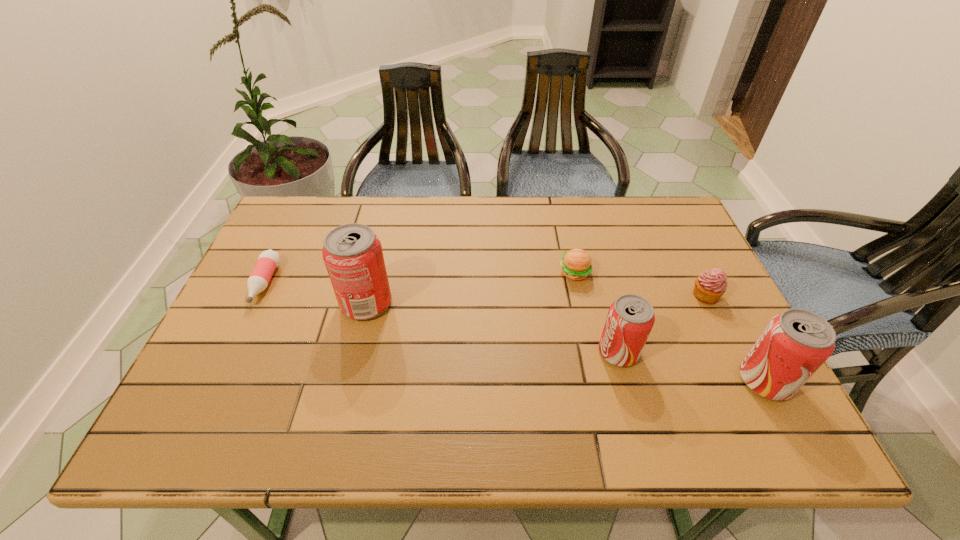
Locate an element on the screen. free space at the far edge of the desktop is located at coordinates (615, 237).

Identify the location of free region at the near edge of the desktop. This screenshot has width=960, height=540. (336, 395).

You are a GUI agent. You are given a task and a screenshot of the screen. Output one action in this format:
    pyautogui.click(x=<x>, y=<y>)
    Task: Click on the vacant region at the left edge of the desktop
    This screenshot has width=960, height=540.
    Given the screenshot: What is the action you would take?
    pyautogui.click(x=303, y=272)

Image resolution: width=960 pixels, height=540 pixels. Find the location of `free space at the right edge of the desktop`. free space at the right edge of the desktop is located at coordinates (681, 258).

In the image, there is a desktop. Identify the location of vacant space at the far left corner. Image resolution: width=960 pixels, height=540 pixels. (325, 210).

In the image, there is a desktop. Where is `free region at the far right corner`? The image size is (960, 540). free region at the far right corner is located at coordinates (666, 203).

The height and width of the screenshot is (540, 960). In order to click on vacant space at the near right corner in this screenshot , I will do click(714, 394).

Locate an element on the screen. vacant region between the bottle and the fifth shortest object is located at coordinates tap(515, 332).

What are the coordinates of `vacant point located between the fourth tallest object and the fifth object from right to left` in the screenshot? It's located at (536, 299).

Locate an element on the screen. The width and height of the screenshot is (960, 540). free area in between the leftmost object and the cupcake is located at coordinates (485, 289).